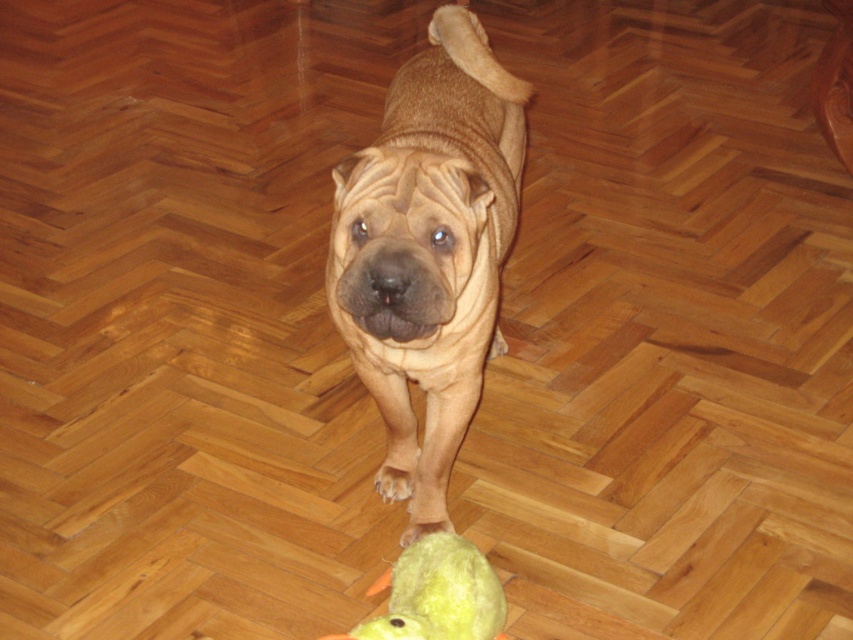
Question: Does brown matte dog at center have a smaller size compared to yellow plush duck at lower center?

Choices:
 (A) yes
 (B) no

Answer: (B)

Question: Can you confirm if yellow plush duck at lower center is positioned to the right of yellow soft toy at lower center?

Choices:
 (A) yes
 (B) no

Answer: (B)

Question: Does brown matte dog at center appear over yellow plush duck at lower center?

Choices:
 (A) yes
 (B) no

Answer: (A)

Question: Among these points, which one is nearest to the camera?

Choices:
 (A) (486, 632)
 (B) (428, 420)

Answer: (A)

Question: Which object appears farthest from the camera in this image?

Choices:
 (A) yellow plush duck at lower center
 (B) brown matte dog at center
 (C) yellow soft toy at lower center

Answer: (C)

Question: Which object is positioned closest to the yellow soft toy at lower center?

Choices:
 (A) yellow plush duck at lower center
 (B) brown matte dog at center

Answer: (A)